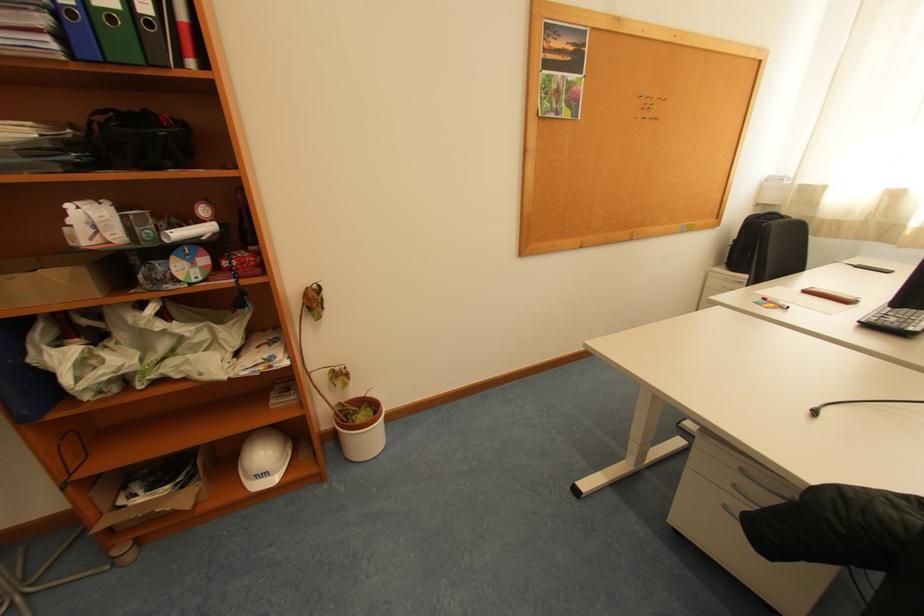
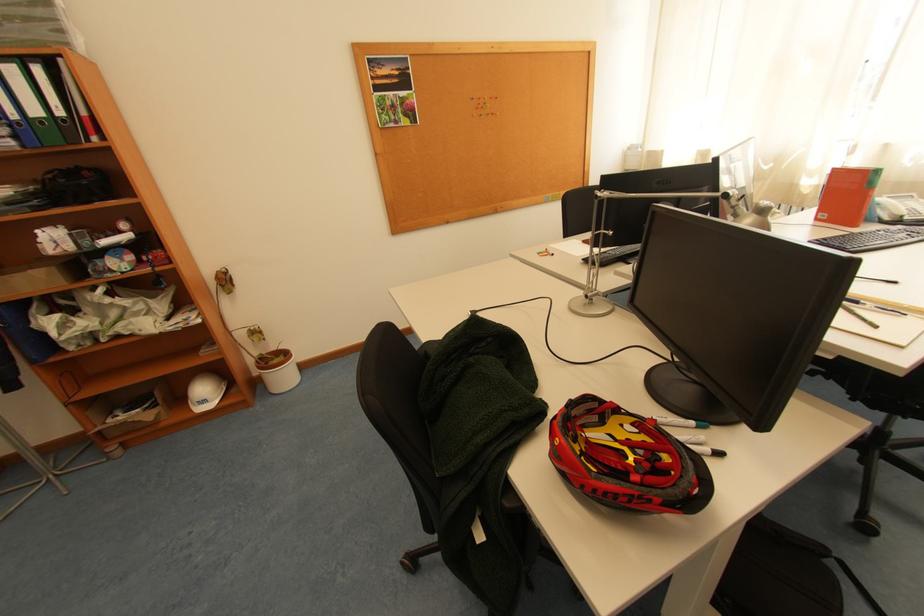
Where in the second image is the point corresponding to (273,476) from the first image?

(213, 402)